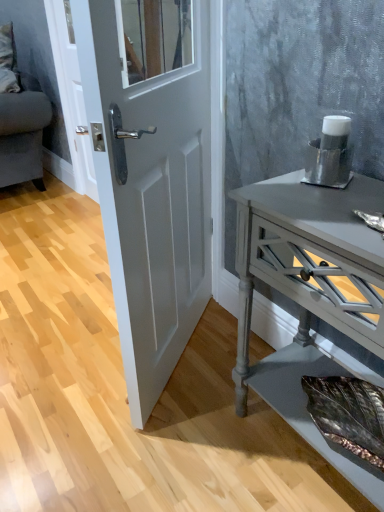
Locate an element on the screen. vacant area that is in front of silver metallic cup at right is located at coordinates (x=329, y=203).